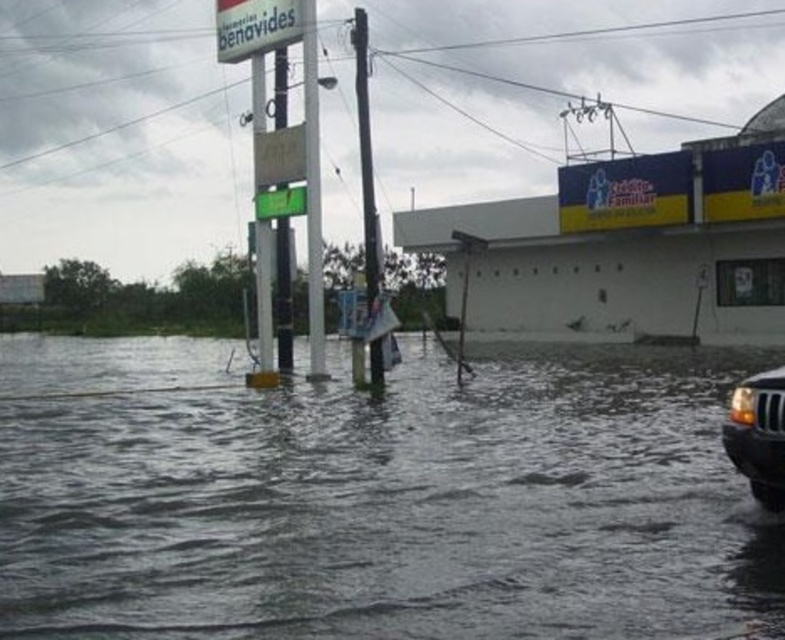
Question: Which object appears closest to the camera in this image?

Choices:
 (A) gray murky water at center
 (B) matte black suv at lower right

Answer: (A)

Question: Does gray murky water at center have a greater width compared to matte black suv at lower right?

Choices:
 (A) yes
 (B) no

Answer: (A)

Question: Which of the following is the farthest from the observer?

Choices:
 (A) matte black suv at lower right
 (B) gray murky water at center

Answer: (A)

Question: Is gray murky water at center wider than matte black suv at lower right?

Choices:
 (A) no
 (B) yes

Answer: (B)

Question: Is gray murky water at center smaller than matte black suv at lower right?

Choices:
 (A) no
 (B) yes

Answer: (A)